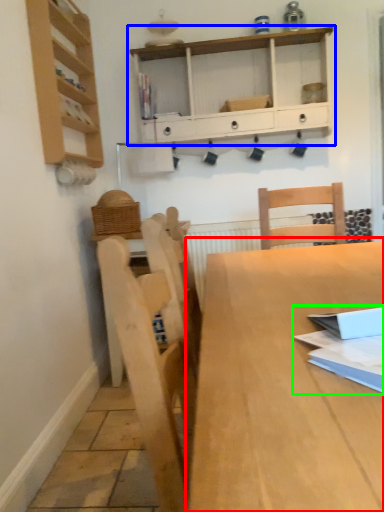
Question: Estimate the real-world distances between objects in this image. Which object is closer to table (highlighted by a red box), shelf (highlighted by a blue box) or book (highlighted by a green box)?

Choices:
 (A) shelf
 (B) book

Answer: (B)